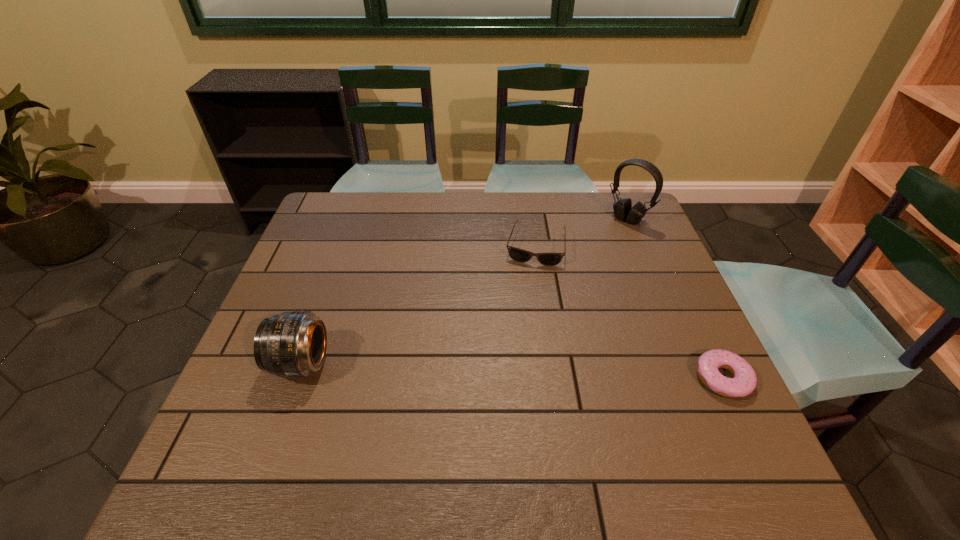
At what (x,y) coordinates should I click in order to perform the action: click on the second tallest object. Please return your answer as a coordinate pair (x, y). Looking at the image, I should click on (292, 344).

Locate an element on the screen. This screenshot has height=540, width=960. the leftmost object is located at coordinates (292, 344).

This screenshot has width=960, height=540. Identify the location of doughnut. (744, 382).

In order to click on the second object from left to right in this screenshot , I will do `click(547, 259)`.

The image size is (960, 540). I want to click on sunglasses, so click(x=547, y=259).

Where is `the tallest object`? The image size is (960, 540). the tallest object is located at coordinates (623, 210).

I want to click on vacant space positioned 0.060m at the front element of the second tallest object, so click(x=250, y=364).

Image resolution: width=960 pixels, height=540 pixels. I want to click on free spot located 0.050m at the front element of the second tallest object, so click(254, 364).

Identify the location of free location located on the back of the shortest object. The height and width of the screenshot is (540, 960). (700, 329).

At what (x,y) coordinates should I click in order to perform the action: click on free location located on the lenses of the third tallest object. Please return your answer as a coordinate pair (x, y). Image resolution: width=960 pixels, height=540 pixels. Looking at the image, I should click on (513, 363).